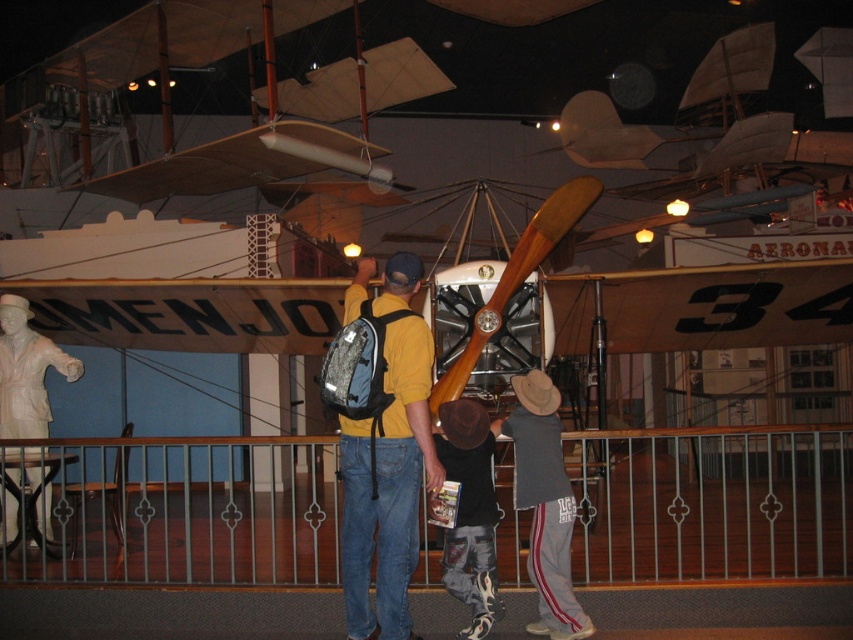
Question: Which of these objects is positioned closest to the white marble statue at lower left?

Choices:
 (A) matte yellow shirt at center
 (B) gray cotton shirt at lower center

Answer: (A)

Question: Does matte yellow shirt at center appear under denim pants at center?

Choices:
 (A) yes
 (B) no

Answer: (B)

Question: Is matte yellow shirt at center to the right of white marble statue at lower left from the viewer's perspective?

Choices:
 (A) yes
 (B) no

Answer: (A)

Question: Does matte yellow shirt at center appear under white marble statue at lower left?

Choices:
 (A) no
 (B) yes

Answer: (B)

Question: Which is farther from the matte yellow shirt at center?

Choices:
 (A) gray cotton shirt at lower center
 (B) metal/rail at center
 (C) white marble statue at lower left

Answer: (C)

Question: Which point appears closest to the camera in this image?

Choices:
 (A) (397, 445)
 (B) (541, 552)
 (C) (10, 296)

Answer: (A)